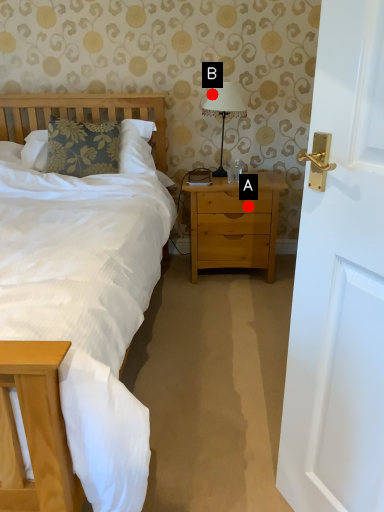
Question: Two points are circled on the image, labeled by A and B beside each circle. Among these points, which one is nearest to the camera?

Choices:
 (A) A is closer
 (B) B is closer

Answer: (B)